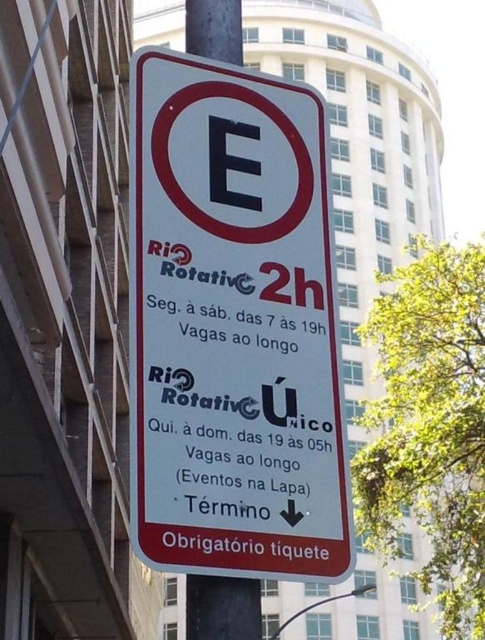
Question: Can you confirm if white plastic sign at center is positioned below black metal pole at center?

Choices:
 (A) yes
 (B) no

Answer: (A)

Question: Which object is closer to the camera taking this photo?

Choices:
 (A) black metal pole at center
 (B) white plastic sign at center

Answer: (B)

Question: Which object is closer to the camera taking this photo?

Choices:
 (A) black metal pole at center
 (B) white plastic sign at center

Answer: (B)

Question: Does white plastic sign at center lie in front of black metal pole at center?

Choices:
 (A) no
 (B) yes

Answer: (B)

Question: Is white plastic sign at center above black metal pole at center?

Choices:
 (A) yes
 (B) no

Answer: (B)